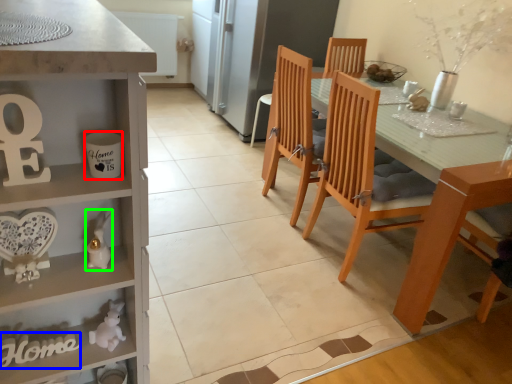
Question: Which object is positioned farthest from coffee cup (highlighted by a red box)? Select from writing (highlighted by a blue box) and toy (highlighted by a green box).

Choices:
 (A) writing
 (B) toy

Answer: (A)